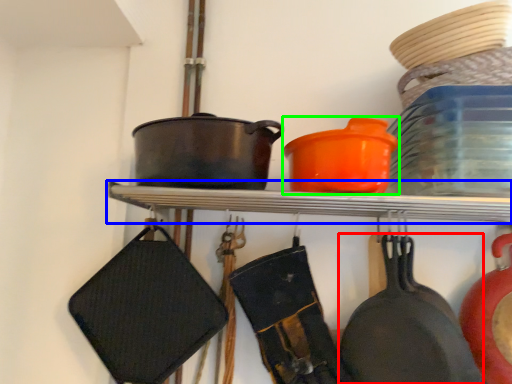
Question: Which object is positioned closest to frying pan (highlighted by a red box)? Select from shelf (highlighted by a blue box) and tableware (highlighted by a green box).

Choices:
 (A) shelf
 (B) tableware

Answer: (A)